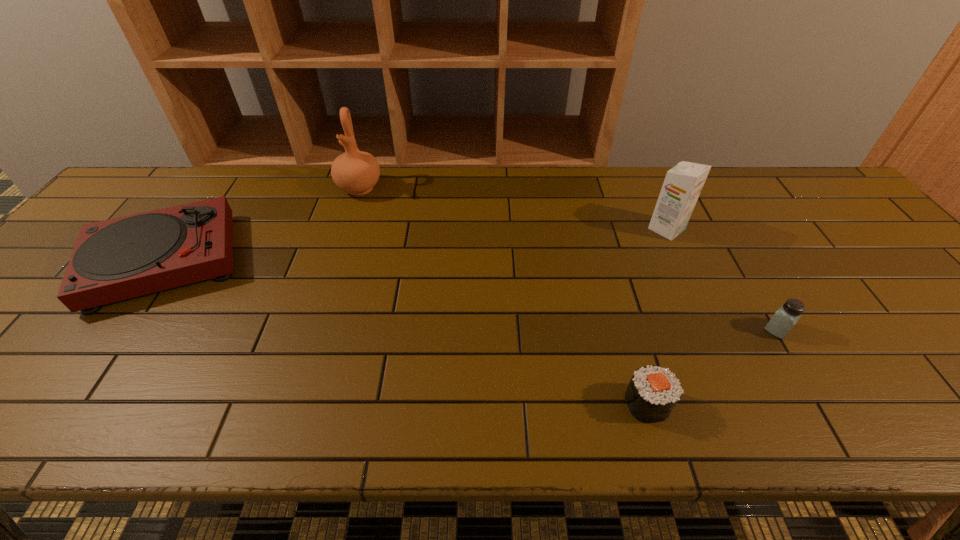
Where is `pottery`? pottery is located at coordinates coord(356,172).

Where is `the farthest object`? the farthest object is located at coordinates (356, 172).

Image resolution: width=960 pixels, height=540 pixels. I want to click on carton, so click(x=682, y=186).

You are a GUI agent. You are given a task and a screenshot of the screen. Output one action in this format:
    pyautogui.click(x=<x>, y=<y>)
    Task: Click on the fourth object from left to right
    The width and height of the screenshot is (960, 540).
    Given the screenshot: What is the action you would take?
    pyautogui.click(x=682, y=186)

Locate an element on the screen. The height and width of the screenshot is (540, 960). the leftmost object is located at coordinates (121, 258).

Locate an element on the screen. the second nearest object is located at coordinates (784, 319).

Locate an element on the screen. the rightmost object is located at coordinates (784, 319).

Identify the location of sushi. tap(653, 392).

At what (x,y) coordinates should I click in order to perform the action: click on the nearest object. Please return your answer as a coordinate pair (x, y). Looking at the image, I should click on (653, 392).

Locate an element on the screen. The image size is (960, 540). vacant space located on the spout of the fourth object from right to left is located at coordinates (350, 216).